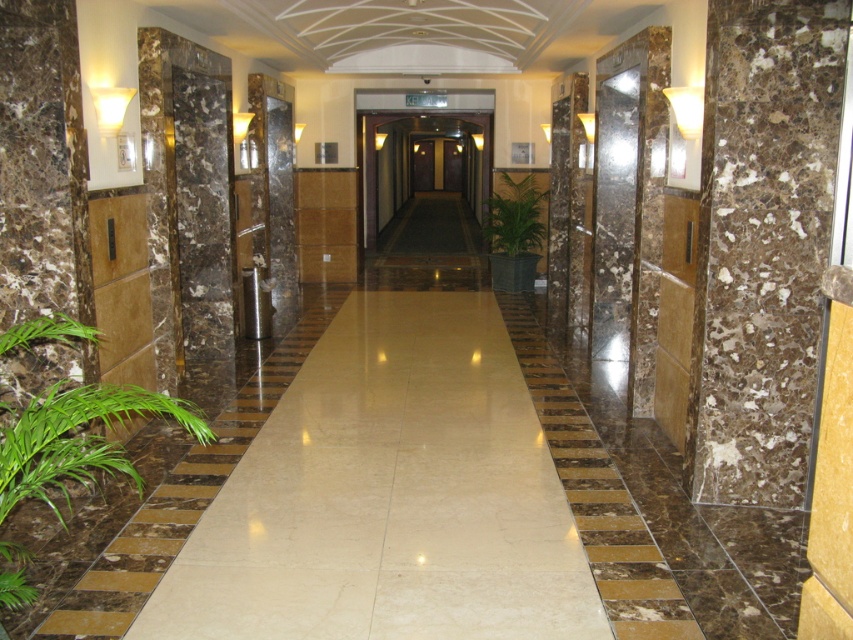
Identify the location of green leafy plant at lower left. (76, 438).

Is green leafy plant at lower left to the right of green leafy plant at center from the viewer's perspective?

In fact, green leafy plant at lower left is to the left of green leafy plant at center.

Does point (33, 492) come behind point (505, 241)?

No, it is in front of (505, 241).

At what (x,y) coordinates should I click in order to perform the action: click on green leafy plant at lower left. Please return your answer as a coordinate pair (x, y). The width and height of the screenshot is (853, 640). Looking at the image, I should click on (76, 438).